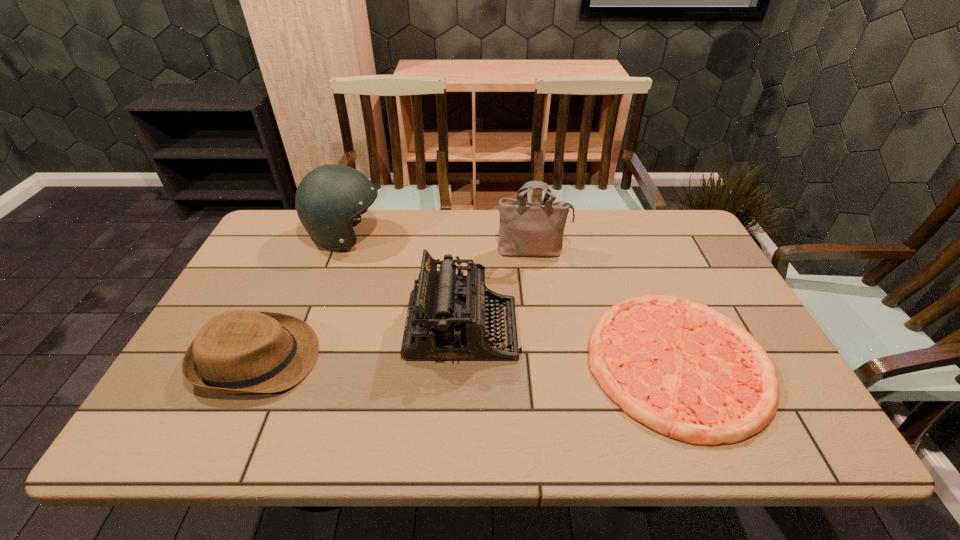
Find the location of a particular element. This screenshot has width=960, height=540. vacant space at the far left corner of the desktop is located at coordinates (299, 235).

The width and height of the screenshot is (960, 540). In the image, there is a desktop. In order to click on vacant space at the far right corner in this screenshot , I will do `click(670, 212)`.

Identify the location of vacant space at the near right corner of the desktop. (775, 444).

Locate an element on the screen. free area in between the fedora and the shoulder bag is located at coordinates (396, 305).

What are the coordinates of `free space that is in between the typewriter and the fedora` in the screenshot? It's located at (361, 344).

The width and height of the screenshot is (960, 540). What are the coordinates of `free space between the typewriter and the pizza` in the screenshot? It's located at (570, 346).

Where is `unoccupied area between the third shortest object and the shoulder bag`? The width and height of the screenshot is (960, 540). unoccupied area between the third shortest object and the shoulder bag is located at coordinates (498, 290).

Where is `unoccupied area between the typewriter and the shoulder bag`? unoccupied area between the typewriter and the shoulder bag is located at coordinates (498, 290).

Identify the location of vacant area that lies between the third tallest object and the football helmet. This screenshot has height=540, width=960. (404, 282).

Locate an element on the screen. free space between the shortest object and the third tallest object is located at coordinates [x=570, y=346].